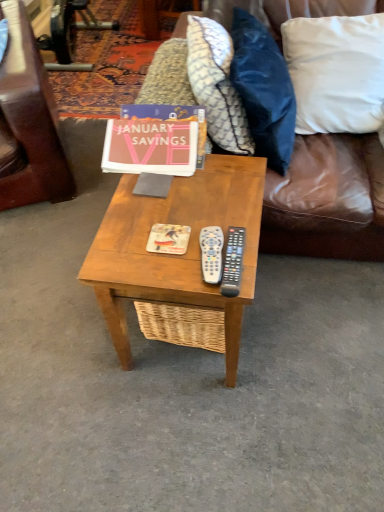
Question: Can you confirm if white plastic remote at center, marked as the second remote in a right-to-left arrangement, is smaller than patterned fabric pillow at upper center, marked as the 1th pillow in a left-to-right arrangement?

Choices:
 (A) no
 (B) yes

Answer: (B)

Question: From the image's perspective, is white plastic remote at center, marked as the second remote in a right-to-left arrangement, below patterned fabric pillow at upper center, the 3th pillow when ordered from right to left?

Choices:
 (A) yes
 (B) no

Answer: (A)

Question: Does white plastic remote at center, which is the first remote from left to right, come in front of patterned fabric pillow at upper center, marked as the 1th pillow in a left-to-right arrangement?

Choices:
 (A) no
 (B) yes

Answer: (B)

Question: From a real-world perspective, is white plastic remote at center, which is the first remote from left to right, below patterned fabric pillow at upper center, marked as the 1th pillow in a left-to-right arrangement?

Choices:
 (A) yes
 (B) no

Answer: (A)

Question: Is white plastic remote at center, marked as the second remote in a right-to-left arrangement, taller than patterned fabric pillow at upper center, marked as the 1th pillow in a left-to-right arrangement?

Choices:
 (A) yes
 (B) no

Answer: (B)

Question: Are white plastic remote at center, marked as the second remote in a right-to-left arrangement, and patterned fabric pillow at upper center, marked as the 1th pillow in a left-to-right arrangement, located far from each other?

Choices:
 (A) yes
 (B) no

Answer: (B)

Question: Is the depth of matte orange magazine at center greater than that of brown leather couch at upper right?

Choices:
 (A) yes
 (B) no

Answer: (A)

Question: Is matte orange magazine at center positioned before brown leather couch at upper right?

Choices:
 (A) no
 (B) yes

Answer: (A)

Question: Is brown leather couch at upper right surrounded by matte orange magazine at center?

Choices:
 (A) no
 (B) yes

Answer: (A)

Question: Considering the relative sizes of matte orange magazine at center and brown leather couch at upper right in the image provided, is matte orange magazine at center thinner than brown leather couch at upper right?

Choices:
 (A) yes
 (B) no

Answer: (A)

Question: From a real-world perspective, is matte orange magazine at center below brown leather couch at upper right?

Choices:
 (A) no
 (B) yes

Answer: (A)

Question: Is matte orange magazine at center shorter than brown leather couch at upper right?

Choices:
 (A) no
 (B) yes

Answer: (B)

Question: Is brown leather couch at upper right further to camera compared to white cotton pillow at upper right, acting as the third pillow starting from the left?

Choices:
 (A) no
 (B) yes

Answer: (A)